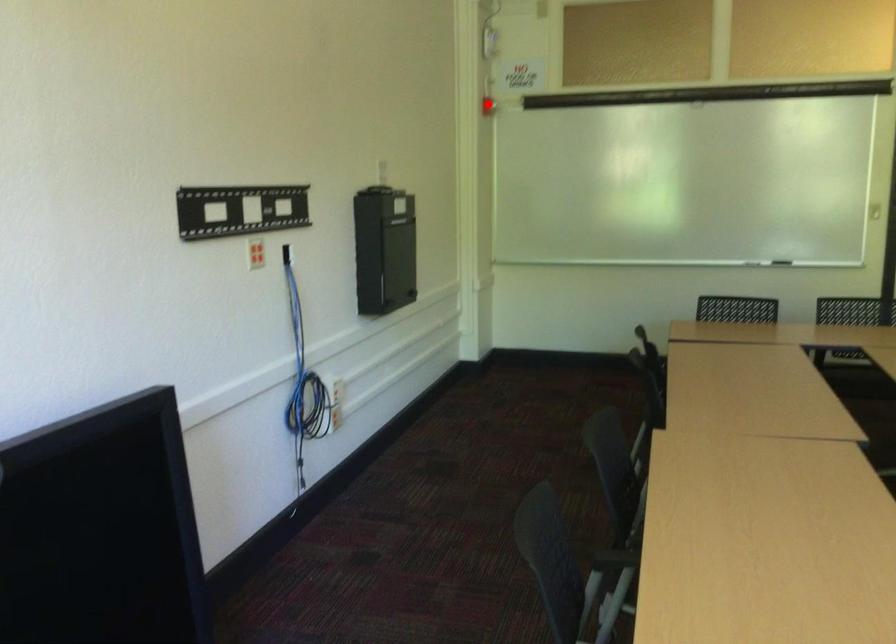
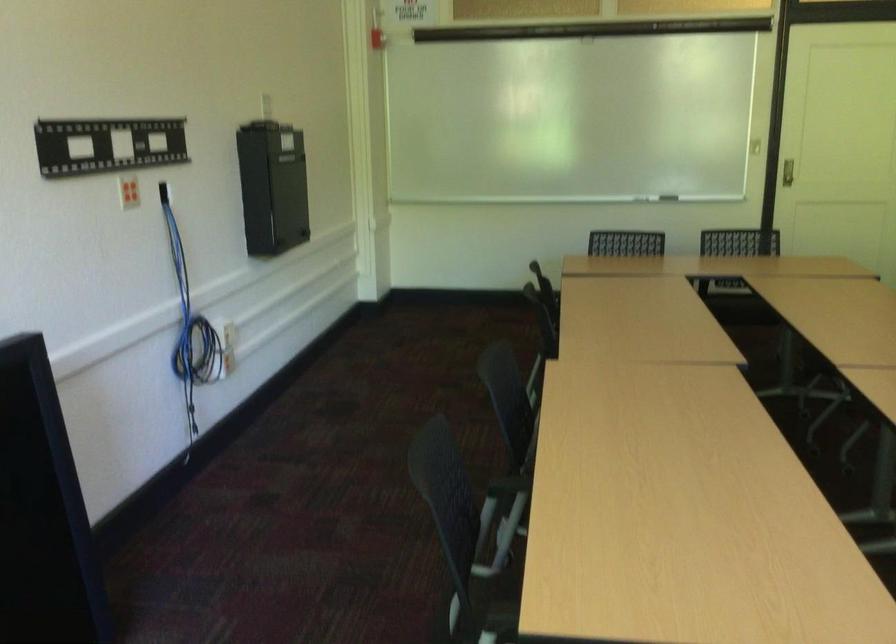
Locate, in the second image, the point that corresponds to the highlighted location in the first image.

(375, 38)